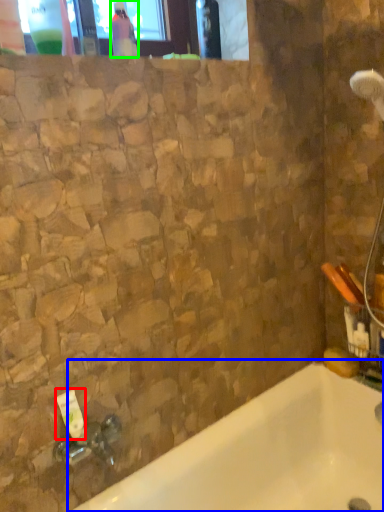
Question: Which object is the closest to the toiletry (highlighted by a red box)? Choose among these: bathtub (highlighted by a blue box) or bottle (highlighted by a green box).

Choices:
 (A) bathtub
 (B) bottle

Answer: (A)